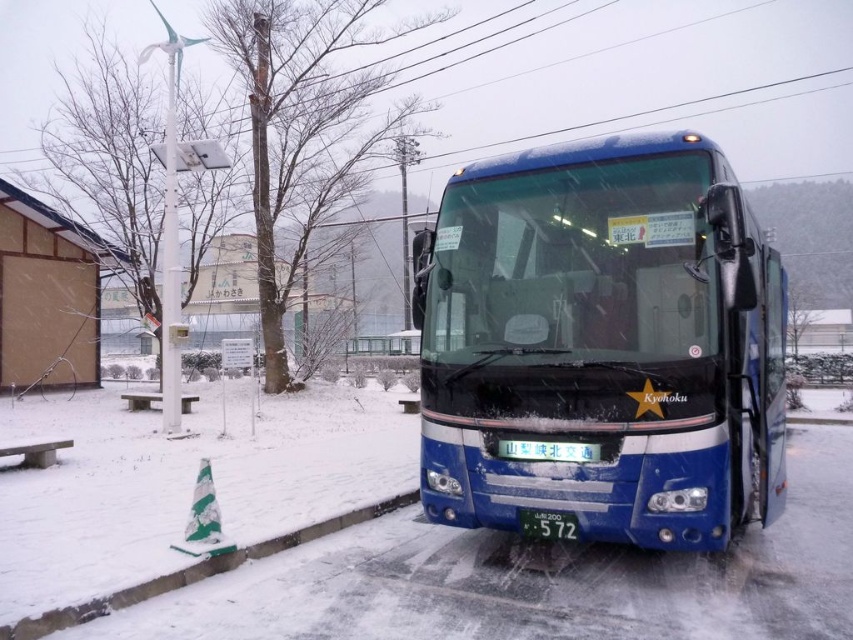
Looking at this image, between green concrete curb at lower left and green striped cone at lower left, which one appears on the right side from the viewer's perspective?

green concrete curb at lower left

Describe the element at coordinates (196, 572) in the screenshot. This screenshot has height=640, width=853. I see `green concrete curb at lower left` at that location.

Locate an element on the screen. green concrete curb at lower left is located at coordinates (196, 572).

Can you confirm if blue metallic bus at center is wider than green matte license plate at center?

Correct, the width of blue metallic bus at center exceeds that of green matte license plate at center.

Is blue metallic bus at center below green matte license plate at center?

No.

Where is `blue metallic bus at center`? blue metallic bus at center is located at coordinates (602, 342).

Can you confirm if green striped cone at lower left is wider than green matte license plate at center?

In fact, green striped cone at lower left might be narrower than green matte license plate at center.

Where is `green striped cone at lower left`? The width and height of the screenshot is (853, 640). green striped cone at lower left is located at coordinates (202, 518).

At what (x,y) coordinates should I click in order to perform the action: click on green striped cone at lower left. Please return your answer as a coordinate pair (x, y). The height and width of the screenshot is (640, 853). Looking at the image, I should click on (202, 518).

Where is `green striped cone at lower left`? This screenshot has width=853, height=640. green striped cone at lower left is located at coordinates point(202,518).